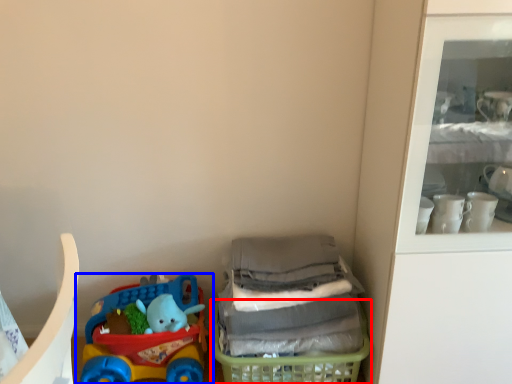
Question: Which point is further to the camera, basket (highlighted by a red box) or toy (highlighted by a blue box)?

Choices:
 (A) basket
 (B) toy

Answer: (B)